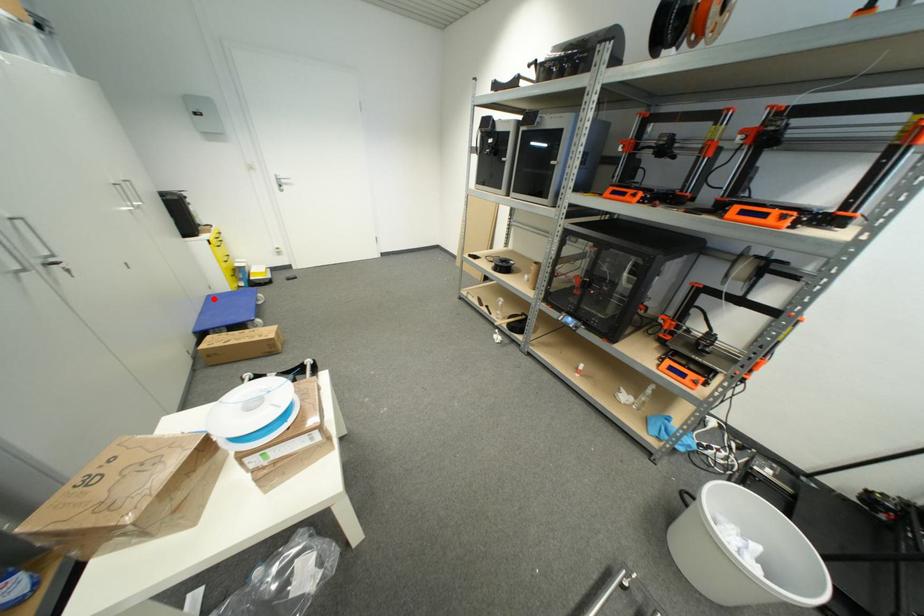
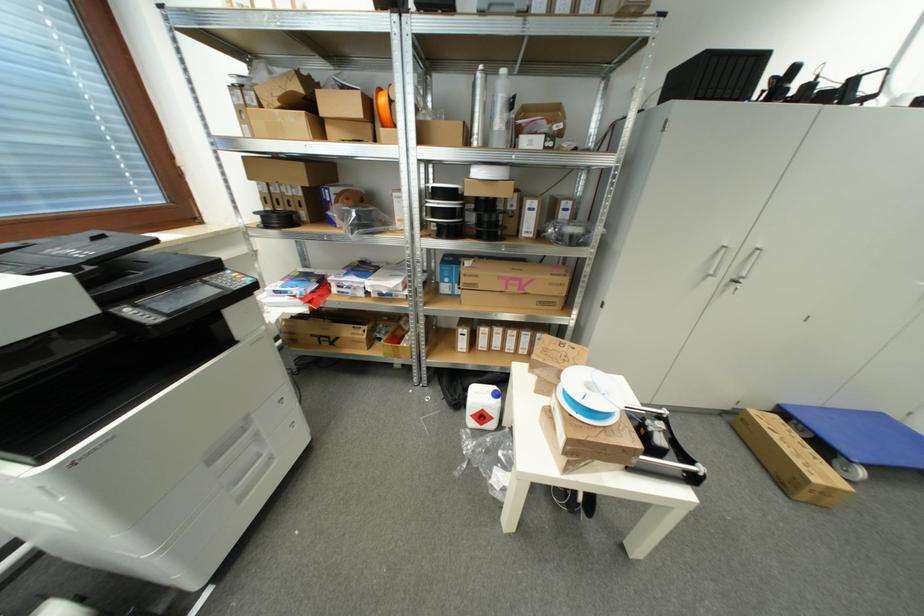
Find the pixel in the second image that matches the highlighted location in the first image.

(885, 418)